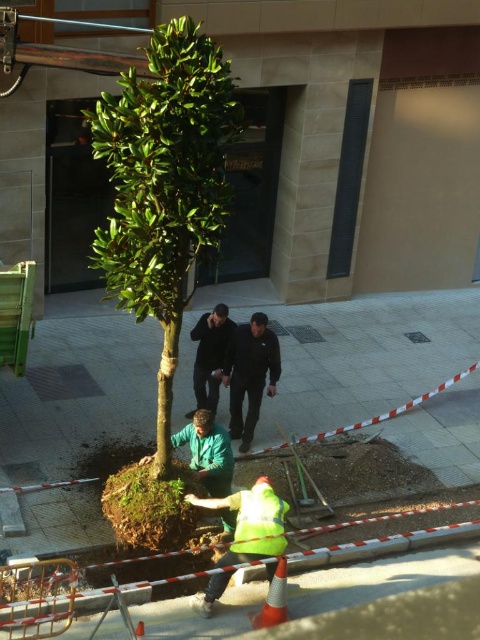
You are a city inspector checking the landscaping work. You notice two workers in the area. One is wearing a high visibility yellow jacket at lower center and another in a dark gray smooth jacket at center. Which worker is positioned closer to the base of the newly planted tree?

The high visibility yellow jacket at lower center is located below the dark gray smooth jacket at center, meaning the worker in the high visibility yellow jacket at lower center is closer to the base of the newly planted tree.

You are a pedestrian walking on the sidewalk and see the green leafy tree at center and the black smooth jacket at center in the image. Which object is higher from the ground?

The green leafy tree at center is located above the black smooth jacket at center, so the green leafy tree at center is higher from the ground.